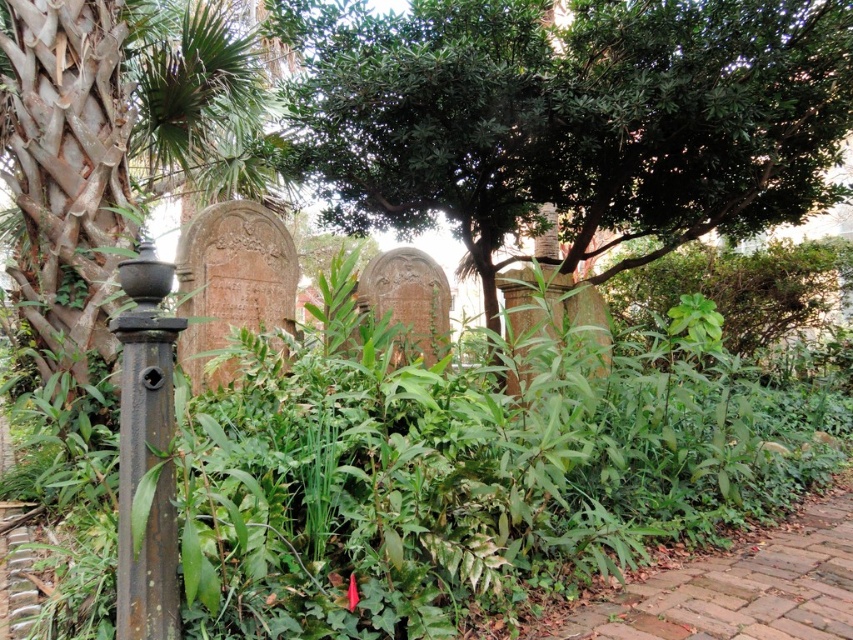
You are a gardener in the cemetery. You need to water the green leafy tree at center and the rusty metal pole at left. Which object should you water first if you want to reach the one closest to you first?

The green leafy tree at center should be watered first because the rusty metal pole at left is behind it, making the tree closer to you.

You are a gardener who needs to prune plants taller than 2 meters. You see the green leafy tree at center and the rusty metal pole at left. Which one should you prune?

The green leafy tree at center is taller than the rusty metal pole at left, so you should prune the green leafy tree at center.

You are a gardener who needs to prune the green leafy tree at center and the brick at lower right. Which object requires a taller ladder to reach its top?

The green leafy tree at center requires a taller ladder to reach its top since it is taller than the brick at lower right.